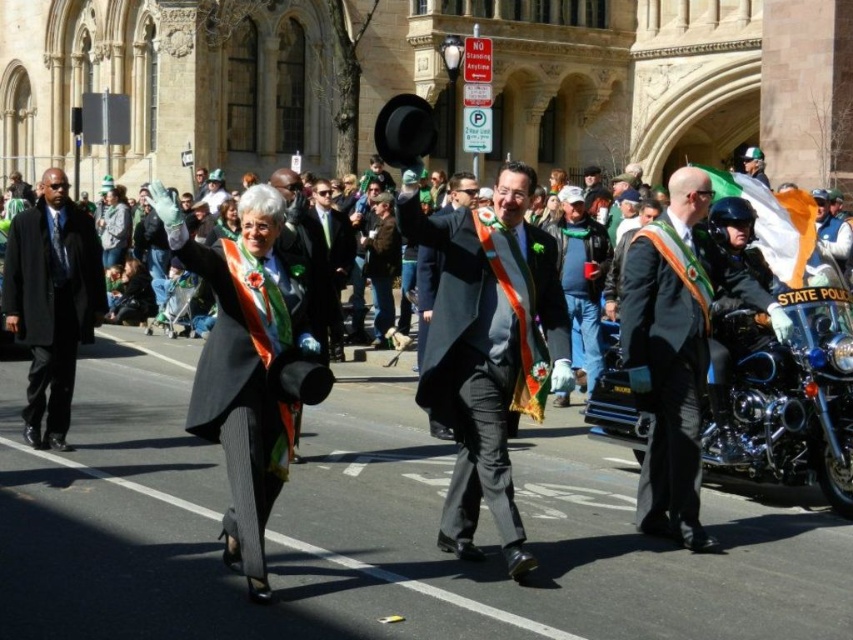
Is point (477, 401) in front of point (846, 401)?

Yes, it is.

Does point (438, 314) come behind point (788, 422)?

No, it is not.

Measure the distance between point (x=450, y=365) and camera.

95.98 feet

Identify the location of shiny black coat at center. The height and width of the screenshot is (640, 853). (488, 349).

The height and width of the screenshot is (640, 853). I want to click on gray wool business suit at right, so click(666, 372).

Locate an element on the screen. gray wool business suit at right is located at coordinates (666, 372).

Between point (613, 369) and point (65, 422), which one is positioned behind?

Positioned behind is point (613, 369).

The image size is (853, 640). What do you see at coordinates (784, 387) in the screenshot?
I see `chrome polished motorcycle at right` at bounding box center [784, 387].

Find the location of a particular element. The height and width of the screenshot is (640, 853). chrome polished motorcycle at right is located at coordinates (784, 387).